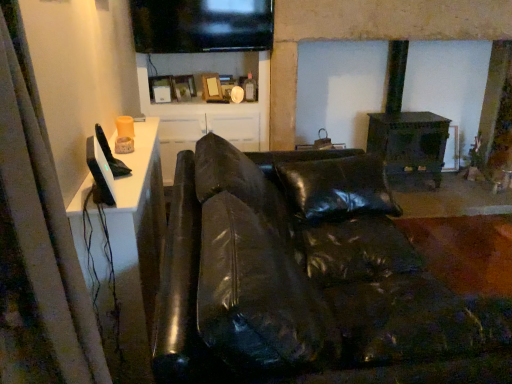
Question: Is white fabric curtain at left turned away from black leather couch at center?

Choices:
 (A) yes
 (B) no

Answer: (B)

Question: Considering the relative positions of white fabric curtain at left and black leather couch at center in the image provided, is white fabric curtain at left in front of black leather couch at center?

Choices:
 (A) yes
 (B) no

Answer: (A)

Question: Does white fabric curtain at left have a larger size compared to black leather couch at center?

Choices:
 (A) yes
 (B) no

Answer: (B)

Question: Is white fabric curtain at left wider than black leather couch at center?

Choices:
 (A) no
 (B) yes

Answer: (A)

Question: Does white fabric curtain at left appear on the right side of black leather couch at center?

Choices:
 (A) no
 (B) yes

Answer: (A)

Question: Would you say white fabric curtain at left is outside black leather couch at center?

Choices:
 (A) no
 (B) yes

Answer: (B)

Question: From a real-world perspective, is white glossy cabinet at upper center below white fabric curtain at left?

Choices:
 (A) no
 (B) yes

Answer: (B)

Question: Considering the relative positions of white glossy cabinet at upper center and white fabric curtain at left in the image provided, is white glossy cabinet at upper center in front of white fabric curtain at left?

Choices:
 (A) no
 (B) yes

Answer: (A)

Question: From a real-world perspective, is white glossy cabinet at upper center positioned over white fabric curtain at left based on gravity?

Choices:
 (A) no
 (B) yes

Answer: (A)

Question: Does white glossy cabinet at upper center have a greater width compared to white fabric curtain at left?

Choices:
 (A) yes
 (B) no

Answer: (A)

Question: Is white glossy cabinet at upper center looking in the opposite direction of white fabric curtain at left?

Choices:
 (A) no
 (B) yes

Answer: (A)

Question: From the image's perspective, is white glossy cabinet at upper center located above white fabric curtain at left?

Choices:
 (A) no
 (B) yes

Answer: (B)

Question: Is black leather couch at center aimed at white fabric curtain at left?

Choices:
 (A) yes
 (B) no

Answer: (B)